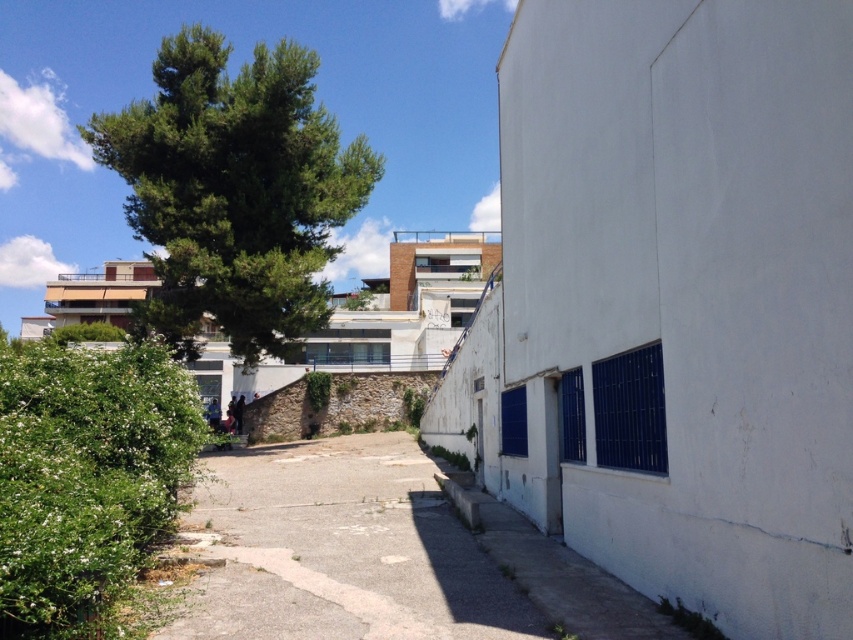
You are a delivery person carrying a heavy package and need to walk from the white building on the right to the green leafy bush at left. The gray concrete path at lower left is the only clear path available. Is the path wide enough for you to comfortably carry the package without stepping into the surrounding greenery?

The gray concrete path at lower left has a lesser width compared to green leafy bush at left. Since the path is narrower than the bush, it may be too narrow for comfortable passage with a heavy package, so you might need to be cautious to avoid stepping into the greenery.

You are a gardener planning to water both the green leafy tree at upper left and the green leafy bush at left. Which one should you water first if you want to start from the farthest point from your current position?

You should water the green leafy tree at upper left first because it is positioned to the left of the green leafy bush at left, making it farther away from your current position.